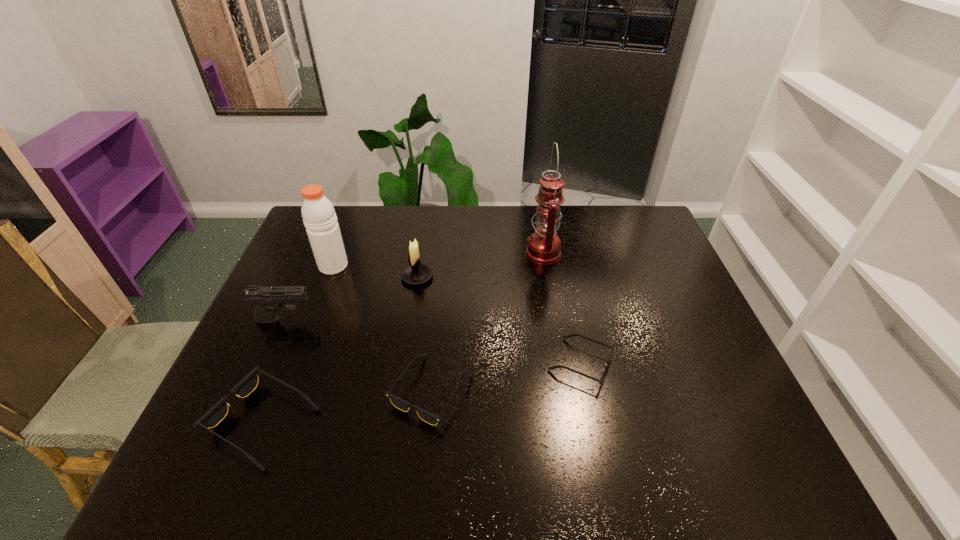
Find the location of `free space located 0.070m on the lenses of the rightmost sunglasses`. free space located 0.070m on the lenses of the rightmost sunglasses is located at coordinates (642, 364).

Identify the location of vacant region located 0.230m on the left of the oil lamp. (456, 253).

Where is `vacant region located 0.180m on the right of the shaker`? vacant region located 0.180m on the right of the shaker is located at coordinates (404, 266).

Locate an element on the screen. The image size is (960, 540). vacant region located 0.060m on the right of the candle holder is located at coordinates (452, 277).

Locate an element on the screen. free space located at the barrel of the fourth tallest object is located at coordinates (340, 320).

The height and width of the screenshot is (540, 960). I want to click on object present at the far edge, so coord(544,245).

Where is `sunglasses at the left edge`? This screenshot has height=540, width=960. sunglasses at the left edge is located at coordinates (217, 413).

The image size is (960, 540). I want to click on shaker located at the left edge, so click(x=319, y=217).

At what (x,y) coordinates should I click in order to perform the action: click on pistol located in the left edge section of the desktop. Please return your answer as a coordinate pair (x, y). The width and height of the screenshot is (960, 540). Looking at the image, I should click on pyautogui.click(x=267, y=300).

Find the location of a particular element. The height and width of the screenshot is (540, 960). object that is positioned at the near left corner is located at coordinates (217, 413).